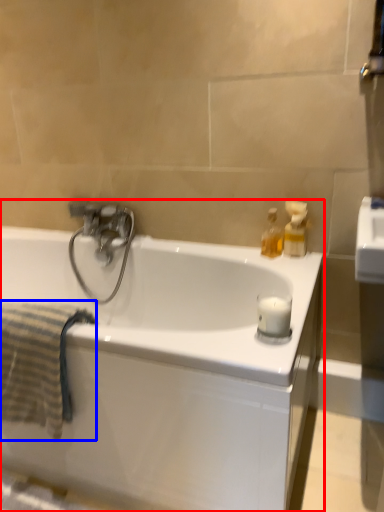
Question: Among these objects, which one is farthest to the camera, bathtub (highlighted by a red box) or bath towel (highlighted by a blue box)?

Choices:
 (A) bathtub
 (B) bath towel

Answer: (B)